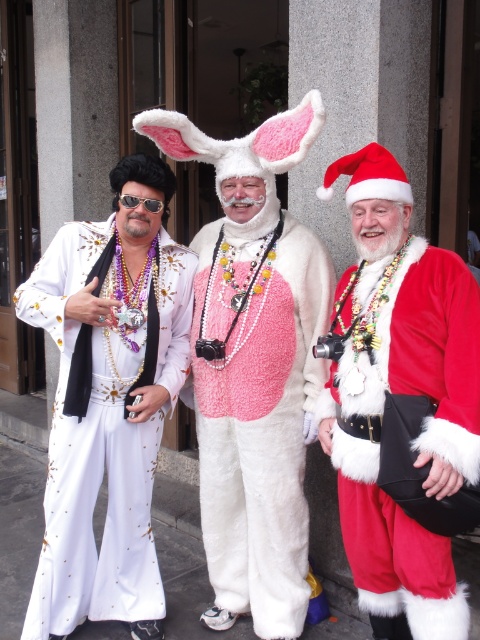
Does red velvet santa suit at right lie in front of velvet red santa suit at center?

That is True.

Who is taller, red velvet santa suit at right or velvet red santa suit at center?

With more height is velvet red santa suit at center.

Is point (368, 184) less distant than point (262, 497)?

That is True.

In order to click on red velvet santa suit at right in this screenshot , I will do `click(402, 406)`.

Looking at this image, between red velvet santa suit at right and white sequined jumpsuit at left, which one is positioned lower?

white sequined jumpsuit at left is lower down.

Can you confirm if red velvet santa suit at right is positioned above white sequined jumpsuit at left?

Yes, red velvet santa suit at right is above white sequined jumpsuit at left.

What are the coordinates of `red velvet santa suit at right` in the screenshot? It's located at (402, 406).

Does velvet red santa suit at center have a smaller size compared to white sequined jumpsuit at left?

Incorrect, velvet red santa suit at center is not smaller in size than white sequined jumpsuit at left.

Does velvet red santa suit at center appear on the right side of white sequined jumpsuit at left?

Yes, velvet red santa suit at center is to the right of white sequined jumpsuit at left.

At what (x,y) coordinates should I click in order to perform the action: click on velvet red santa suit at center. Please return your answer as a coordinate pair (x, y). This screenshot has width=480, height=640. Looking at the image, I should click on (253, 365).